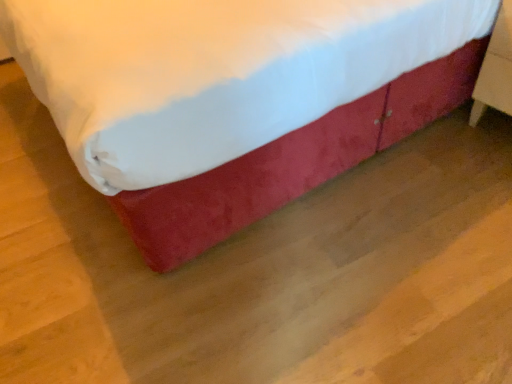
Describe the element at coordinates (236, 98) in the screenshot. The height and width of the screenshot is (384, 512). I see `velvet red bed at center` at that location.

Locate an element on the screen. The height and width of the screenshot is (384, 512). velvet red bed at center is located at coordinates (236, 98).

The height and width of the screenshot is (384, 512). Describe the element at coordinates (495, 69) in the screenshot. I see `wooden nightstand at right` at that location.

Measure the distance between wooden nightstand at right and camera.

1.45 meters.

What is the approximate width of wooden nightstand at right?

wooden nightstand at right is 46.30 centimeters wide.

Locate an element on the screen. wooden nightstand at right is located at coordinates (495, 69).

Where is `velvet red bed at center`? Image resolution: width=512 pixels, height=384 pixels. velvet red bed at center is located at coordinates (236, 98).

Between velvet red bed at center and wooden nightstand at right, which one appears on the left side from the viewer's perspective?

velvet red bed at center.

Which object is further away from the camera taking this photo, velvet red bed at center or wooden nightstand at right?

Positioned behind is wooden nightstand at right.

Does point (286, 160) lie in front of point (487, 49)?

That is True.

From the image's perspective, which one is positioned higher, velvet red bed at center or wooden nightstand at right?

From the image's view, velvet red bed at center is above.

From a real-world perspective, does velvet red bed at center stand above wooden nightstand at right?

Yes.

Looking at their sizes, would you say velvet red bed at center is wider or thinner than wooden nightstand at right?

velvet red bed at center is wider than wooden nightstand at right.

Which of these two, velvet red bed at center or wooden nightstand at right, stands taller?

With more height is velvet red bed at center.

Between velvet red bed at center and wooden nightstand at right, which one has larger size?

Bigger between the two is velvet red bed at center.

Does velvet red bed at center contain wooden nightstand at right?

That's correct, wooden nightstand at right is inside velvet red bed at center.

Are velvet red bed at center and wooden nightstand at right making contact?

No, velvet red bed at center is not next to wooden nightstand at right.

Based on the photo, is wooden nightstand at right at the back of velvet red bed at center?

That's not correct — velvet red bed at center is not looking away from wooden nightstand at right.

Where is `bed above the wooden nightstand at right (from a real-world perspective)`? bed above the wooden nightstand at right (from a real-world perspective) is located at coordinates (236, 98).

Consider the image. Between wooden nightstand at right and velvet red bed at center, which one appears on the left side from the viewer's perspective?

Positioned to the left is velvet red bed at center.

Relative to velvet red bed at center, is wooden nightstand at right in front or behind?

In the image, wooden nightstand at right appears behind velvet red bed at center.

Is point (480, 75) closer or farther from the camera than point (320, 169)?

Clearly, point (480, 75) is more distant from the camera than point (320, 169).

From the image's perspective, relative to velvet red bed at center, is wooden nightstand at right above or below?

Clearly, from the image's perspective, wooden nightstand at right is below velvet red bed at center.

In the scene shown: From a real-world perspective, is wooden nightstand at right on top of velvet red bed at center?

Actually, wooden nightstand at right is physically below velvet red bed at center in the real world.

Can you confirm if wooden nightstand at right is thinner than velvet red bed at center?

Indeed, wooden nightstand at right has a lesser width compared to velvet red bed at center.

Considering the sizes of wooden nightstand at right and velvet red bed at center in the image, is wooden nightstand at right taller or shorter than velvet red bed at center?

In the image, wooden nightstand at right appears to be shorter than velvet red bed at center.

Considering the relative sizes of wooden nightstand at right and velvet red bed at center in the image provided, is wooden nightstand at right bigger than velvet red bed at center?

Incorrect, wooden nightstand at right is not larger than velvet red bed at center.

Is wooden nightstand at right spatially inside velvet red bed at center, or outside of it?

wooden nightstand at right is inside velvet red bed at center.

From the picture: Is wooden nightstand at right in contact with velvet red bed at center?

wooden nightstand at right is not next to velvet red bed at center, and they're not touching.

Could you tell me if wooden nightstand at right is facing velvet red bed at center?

Yes, wooden nightstand at right is aimed at velvet red bed at center.

How different are the orientations of wooden nightstand at right and velvet red bed at center in degrees?

wooden nightstand at right and velvet red bed at center are facing 6.66 degrees away from each other.

Locate an element on the screen. The height and width of the screenshot is (384, 512). bed in front of the wooden nightstand at right is located at coordinates (236, 98).

This screenshot has height=384, width=512. Find the location of `bed above the wooden nightstand at right (from the image's perspective)`. bed above the wooden nightstand at right (from the image's perspective) is located at coordinates (236, 98).

Locate an element on the screen. The image size is (512, 384). furniture located underneath the velvet red bed at center (from a real-world perspective) is located at coordinates (495, 69).